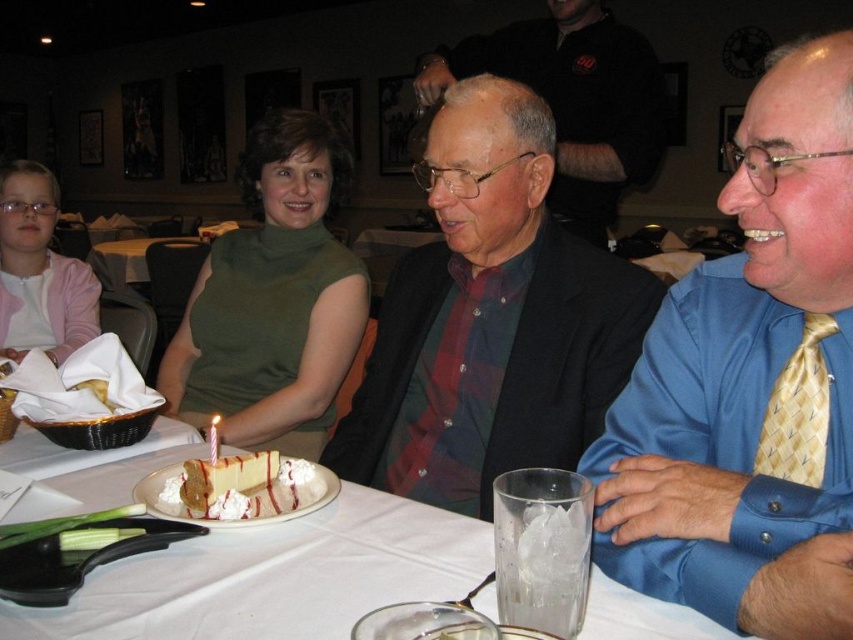
Is matte black jacket at center wider than vanilla sponge cake with whipped cream at center?

Indeed, matte black jacket at center has a greater width compared to vanilla sponge cake with whipped cream at center.

Is matte black jacket at center below vanilla sponge cake with whipped cream at center?

No.

Measure the distance between point (532, 93) and camera.

Point (532, 93) is 1.44 meters from camera.

Find the location of a particular element. matte black jacket at center is located at coordinates (490, 320).

Between green matte dress at center and white paper birthday candle at center, which one is positioned higher?

green matte dress at center is above.

Can you confirm if green matte dress at center is positioned above white paper birthday candle at center?

Yes, green matte dress at center is above white paper birthday candle at center.

Between point (192, 326) and point (213, 458), which one is positioned behind?

The point (192, 326) is behind.

Where is `green matte dress at center`? This screenshot has width=853, height=640. green matte dress at center is located at coordinates (273, 300).

Can you confirm if blue satin shirt at center is thinner than matte black jacket at center?

Yes, blue satin shirt at center is thinner than matte black jacket at center.

Can you confirm if blue satin shirt at center is shorter than matte black jacket at center?

Yes.

Is point (827, 106) less distant than point (369, 400)?

Yes, point (827, 106) is closer to viewer.

In order to click on blue satin shirt at center in this screenshot , I will do coord(750,385).